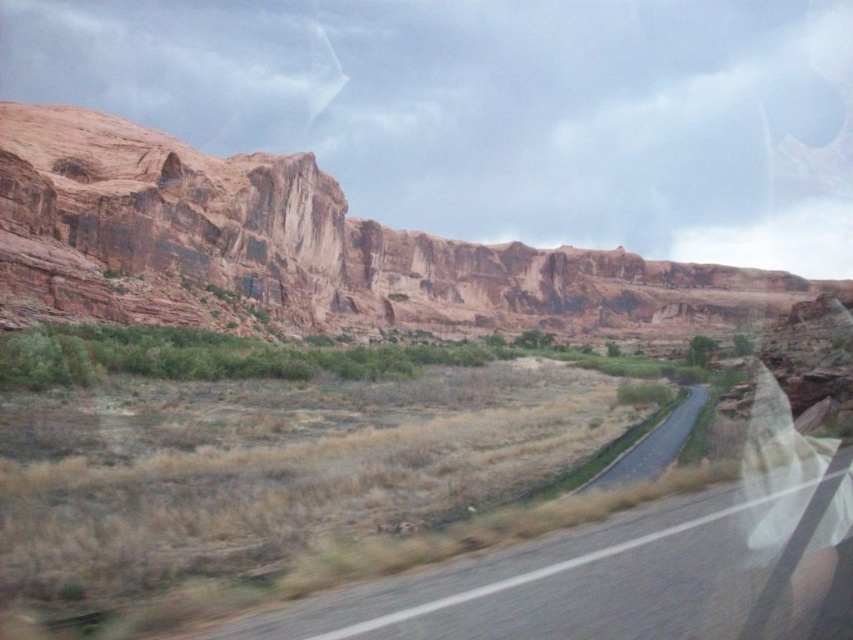
Question: Which point is farther from the camera taking this photo?

Choices:
 (A) (700, 406)
 (B) (604, 316)

Answer: (B)

Question: Is gray asphalt road at center thinner than black asphalt road at center?

Choices:
 (A) no
 (B) yes

Answer: (B)

Question: Among these points, which one is farthest from the camera?

Choices:
 (A) (650, 445)
 (B) (735, 628)

Answer: (A)

Question: Does gray asphalt road at center have a greater width compared to black asphalt road at center?

Choices:
 (A) yes
 (B) no

Answer: (B)

Question: Which object appears farthest from the camera in this image?

Choices:
 (A) gray asphalt road at center
 (B) black asphalt road at center
 (C) rustic rock formation at upper left

Answer: (C)

Question: Is rustic rock formation at upper left further to the viewer compared to gray asphalt road at center?

Choices:
 (A) yes
 (B) no

Answer: (A)